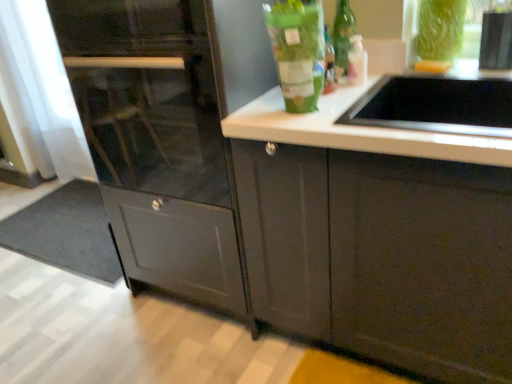
Question: Considering the positions of matte gray cabinet at center and gray matte doormat at lower left in the image, is matte gray cabinet at center bigger or smaller than gray matte doormat at lower left?

Choices:
 (A) big
 (B) small

Answer: (A)

Question: Considering the positions of point (157, 190) and point (64, 253), is point (157, 190) closer or farther from the camera than point (64, 253)?

Choices:
 (A) farther
 (B) closer

Answer: (B)

Question: Which object is positioned farthest from the matte gray cabinet at center?

Choices:
 (A) green matte bag at upper center, the 1th bottle viewed from the left
 (B) gray matte doormat at lower left
 (C) translucent glass bottle at upper right, the 2th bottle from the front
 (D) green glass vase at upper right
 (E) green glass bottle at upper center

Answer: (D)

Question: Considering the real-world distances, which object is farthest from the matte gray cabinet at center?

Choices:
 (A) green glass bottle at upper center
 (B) gray matte doormat at lower left
 (C) translucent glass bottle at upper right, placed as the first bottle when sorted from right to left
 (D) green matte bag at upper center, the 1th bottle viewed from the left
 (E) green glass vase at upper right

Answer: (E)